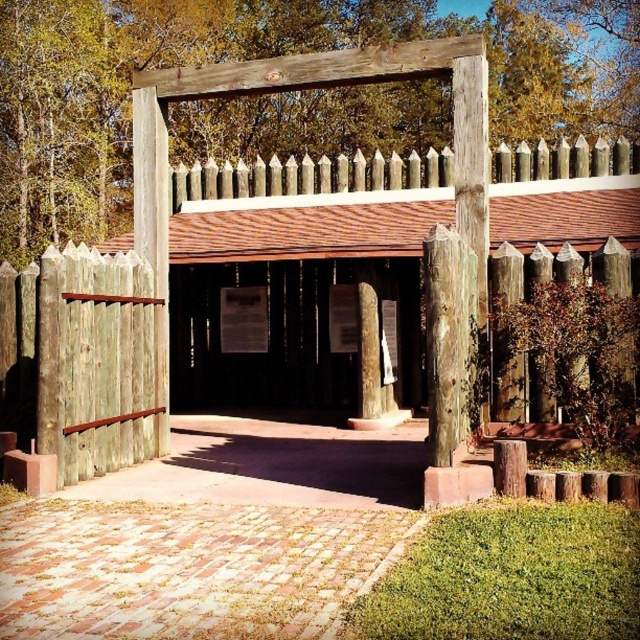
Question: Among these objects, which one is farthest from the camera?

Choices:
 (A) wooden signpost at center
 (B) weathered wood gate at center

Answer: (A)

Question: Is wooden signpost at center below weathered wood gate at center?

Choices:
 (A) yes
 (B) no

Answer: (A)

Question: Does wooden signpost at center have a greater width compared to weathered wood gate at center?

Choices:
 (A) no
 (B) yes

Answer: (A)

Question: Is wooden signpost at center wider than weathered wood gate at center?

Choices:
 (A) no
 (B) yes

Answer: (A)

Question: Which of the following is the closest to the observer?

Choices:
 (A) weathered wood gate at center
 (B) wooden signpost at center

Answer: (A)

Question: Among these points, which one is nearest to the camera?

Choices:
 (A) (84, 392)
 (B) (358, 419)

Answer: (A)